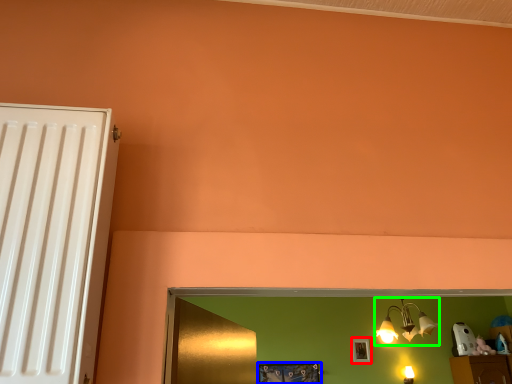
Question: Considering the real-world distances, which object is farthest from picture frame (highlighted by a red box)? picture frame (highlighted by a blue box) or lamp (highlighted by a green box)?

Choices:
 (A) picture frame
 (B) lamp

Answer: (A)